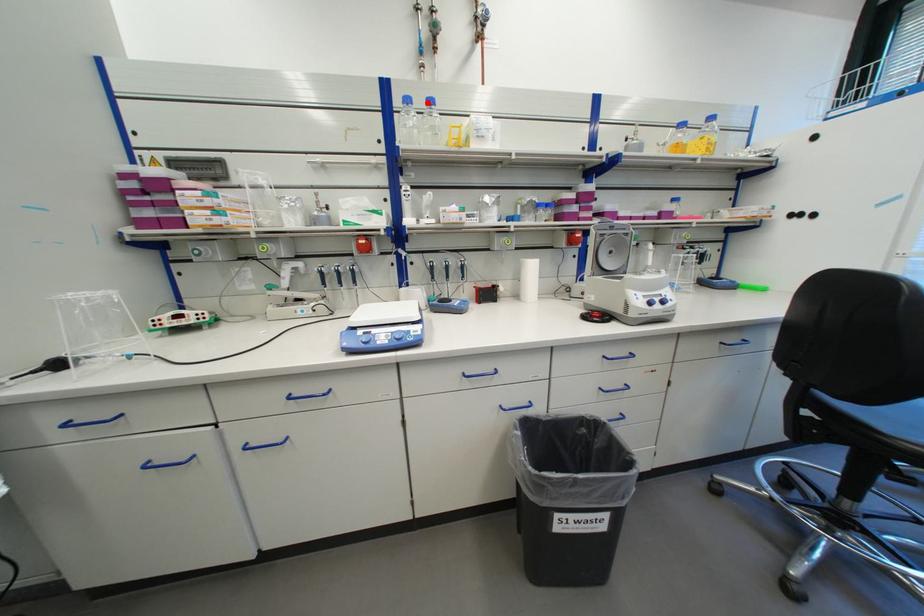
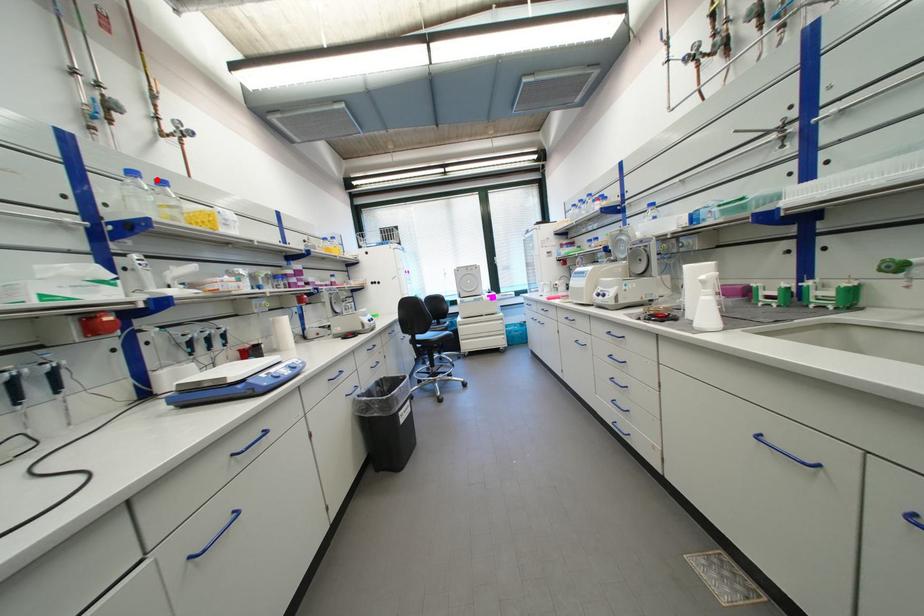
I am providing you with two images of the same scene from different viewpoints. A red point is marked on the first image and another point is marked on the second image. Are the points marked in image1 and image2 representing the same 3D position?

Yes